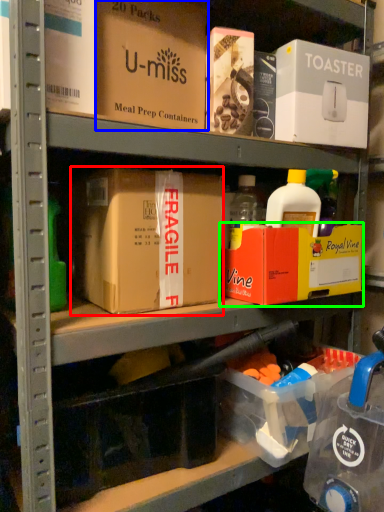
Question: Based on their relative distances, which object is farther from box (highlighted by a red box)? Choose from box (highlighted by a blue box) and box (highlighted by a green box).

Choices:
 (A) box
 (B) box

Answer: (A)